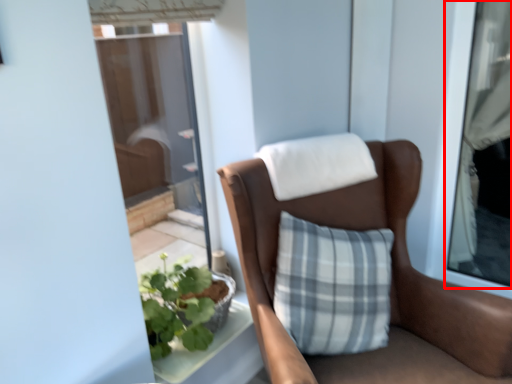
Question: In this image, where is window (annotated by the red box) located relative to chair?

Choices:
 (A) right
 (B) left

Answer: (A)